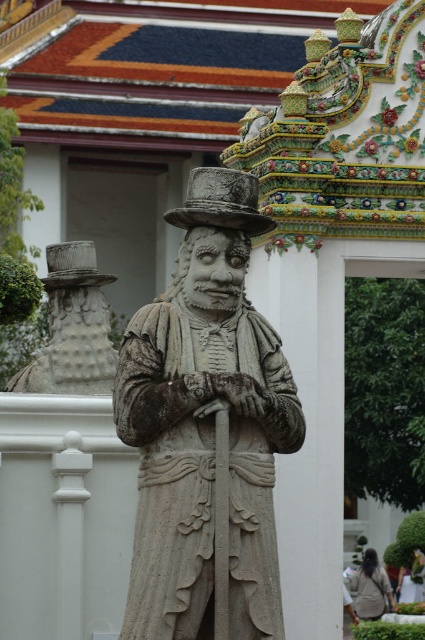
Question: Is gray stone statue at left bigger than light brown fabric jacket at lower right?

Choices:
 (A) yes
 (B) no

Answer: (A)

Question: Which point is closer to the camera taking this photo?

Choices:
 (A) (19, 388)
 (B) (277, 605)

Answer: (B)

Question: Which point appears farthest from the camera in this image?

Choices:
 (A) (17, 378)
 (B) (382, 576)

Answer: (B)

Question: Can you confirm if stone statue at center is positioned to the right of light brown fabric jacket at lower right?

Choices:
 (A) no
 (B) yes

Answer: (A)

Question: Can you confirm if gray stone statue at left is positioned to the left of light brown fabric jacket at lower right?

Choices:
 (A) no
 (B) yes

Answer: (B)

Question: Which point appears closest to the camera in this image?

Choices:
 (A) (374, 605)
 (B) (150, 554)
 (C) (74, 372)

Answer: (B)